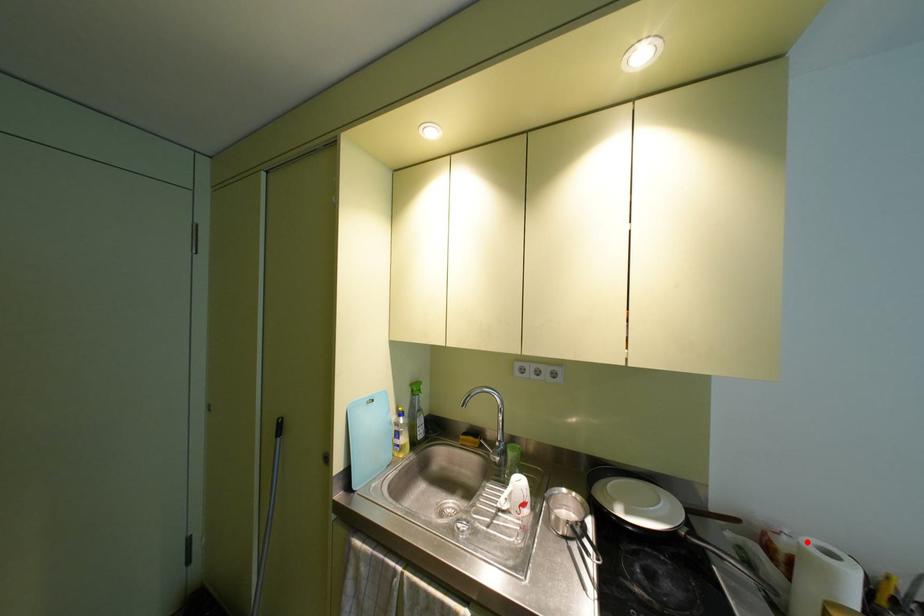
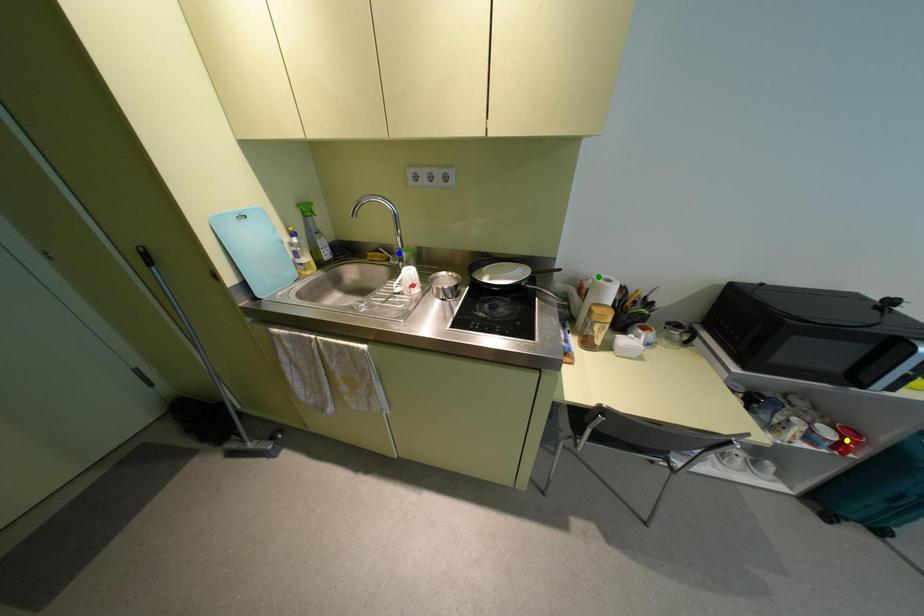
Question: I am providing you with two images of the same scene from different viewpoints. A red point is marked on the first image. You are given multiple points on the second image. Which spot in image 2 lines up with the point in image 1?

Choices:
 (A) green point
 (B) yellow point
 (C) blue point

Answer: (A)